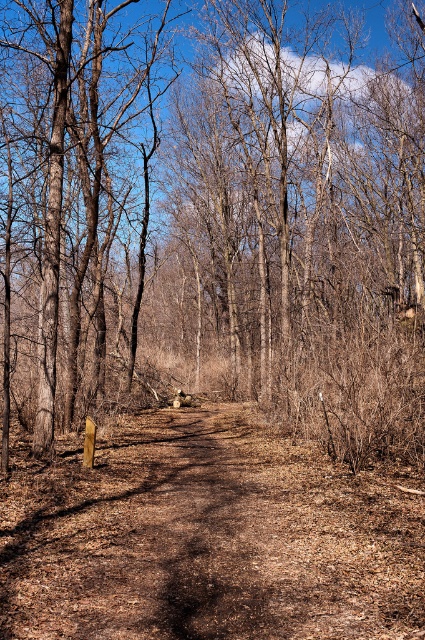
Is brown dirt track at center further to camera compared to brown rough tree at left?

No, it is not.

Is point (155, 547) in front of point (124, 269)?

Yes.

What do you see at coordinates (206, 538) in the screenshot? I see `brown dirt track at center` at bounding box center [206, 538].

Where is `brown dirt track at center`? brown dirt track at center is located at coordinates coord(206,538).

Which of these two, brown dry leaves at center or brown rough tree at left, stands shorter?

brown dry leaves at center is shorter.

Does brown dry leaves at center appear under brown rough tree at left?

Actually, brown dry leaves at center is above brown rough tree at left.

Who is more forward, (272, 371) or (124, 352)?

Point (272, 371)

Where is `brown dry leaves at center`? This screenshot has height=640, width=425. brown dry leaves at center is located at coordinates (214, 218).

Between brown dry leaves at center and brown dirt track at center, which one appears on the right side from the viewer's perspective?

brown dry leaves at center is more to the right.

Is brown dry leaves at center positioned at the back of brown dirt track at center?

Yes.

Between point (308, 296) and point (127, 541), which one is positioned behind?

Point (308, 296)

Where is `brown dry leaves at center`? Image resolution: width=425 pixels, height=640 pixels. brown dry leaves at center is located at coordinates (214, 218).